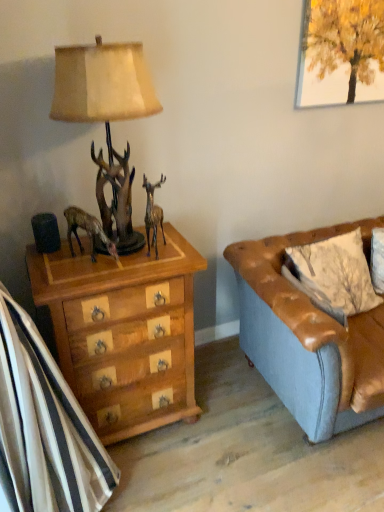
Identify the location of vacant area that lies to the right of antique brown statue at left. (133, 261).